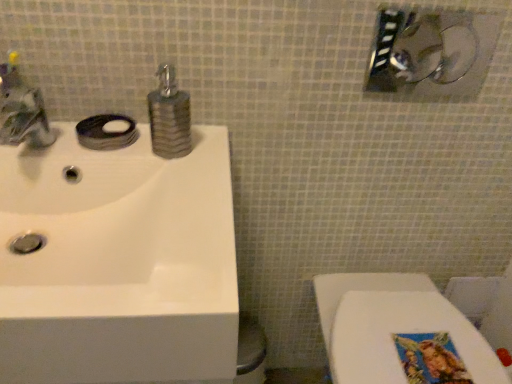
What do you see at coordinates (399, 332) in the screenshot?
I see `white glossy toilet at lower right` at bounding box center [399, 332].

The height and width of the screenshot is (384, 512). What do you see at coordinates (117, 126) in the screenshot? I see `matte silver soap at sink left` at bounding box center [117, 126].

The height and width of the screenshot is (384, 512). What do you see at coordinates (113, 248) in the screenshot?
I see `white glossy sink at upper left` at bounding box center [113, 248].

What is the approximate height of white glossy sink at upper left?

white glossy sink at upper left is 13.50 centimeters in height.

Image resolution: width=512 pixels, height=384 pixels. Identify the location of white glossy toilet at lower right. (399, 332).

From a real-world perspective, is white glossy sink at upper left under white glossy toilet at lower right?

Actually, white glossy sink at upper left is physically above white glossy toilet at lower right in the real world.

Is white glossy sink at upper left to the left of white glossy toilet at lower right from the viewer's perspective?

Yes.

The image size is (512, 384). What are the coordinates of `toilet below the white glossy sink at upper left (from the image's perspective)` in the screenshot? It's located at (399, 332).

Is white glossy sink at upper left thinner than white glossy toilet at lower right?

No, white glossy sink at upper left is not thinner than white glossy toilet at lower right.

From a real-world perspective, who is located lower, matte silver soap at sink left or brushed metal showerhead at upper right?

matte silver soap at sink left.

Does point (108, 129) appear closer or farther from the camera than point (468, 50)?

Clearly, point (108, 129) is closer to the camera than point (468, 50).

Between matte silver soap at sink left and brushed metal showerhead at upper right, which one has smaller size?

matte silver soap at sink left.

Based on the photo, is textured brown soap dispenser at center inside the boundaries of brushed metal faucet at upper left, or outside?

textured brown soap dispenser at center cannot be found inside brushed metal faucet at upper left.

Is textured brown soap dispenser at center next to brushed metal faucet at upper left and touching it?

No, textured brown soap dispenser at center is not beside brushed metal faucet at upper left.

Which object is thinner, textured brown soap dispenser at center or brushed metal faucet at upper left?

textured brown soap dispenser at center is thinner.

Which object is further away from the camera, textured brown soap dispenser at center or brushed metal faucet at upper left?

Positioned behind is textured brown soap dispenser at center.

In terms of height, does matte silver soap at sink left look taller or shorter compared to textured brown soap dispenser at center?

Clearly, matte silver soap at sink left is shorter compared to textured brown soap dispenser at center.

In the image, is matte silver soap at sink left positioned in front of or behind textured brown soap dispenser at center?

In the image, matte silver soap at sink left appears behind textured brown soap dispenser at center.

Could you tell me if matte silver soap at sink left is turned towards textured brown soap dispenser at center?

No, matte silver soap at sink left is not oriented towards textured brown soap dispenser at center.

Is there a large distance between matte silver soap at sink left and textured brown soap dispenser at center?

No, matte silver soap at sink left is in close proximity to textured brown soap dispenser at center.

Relative to brushed metal faucet at upper left, is brushed metal showerhead at upper right in front or behind?

Clearly, brushed metal showerhead at upper right is behind brushed metal faucet at upper left.

The height and width of the screenshot is (384, 512). I want to click on shower that is above the brushed metal faucet at upper left (from the image's perspective), so click(422, 50).

Are brushed metal showerhead at upper right and brushed metal faucet at upper left far apart?

No, brushed metal showerhead at upper right is not far away from brushed metal faucet at upper left.

Can you confirm if white glossy toilet at lower right is thinner than textured brown soap dispenser at center?

No, white glossy toilet at lower right is not thinner than textured brown soap dispenser at center.

Is white glossy toilet at lower right positioned with its back to textured brown soap dispenser at center?

No, textured brown soap dispenser at center is not at the back of white glossy toilet at lower right.

How many degrees apart are the facing directions of white glossy toilet at lower right and textured brown soap dispenser at center?

white glossy toilet at lower right and textured brown soap dispenser at center are facing 1.16 degrees away from each other.

Does white glossy toilet at lower right have a larger size compared to textured brown soap dispenser at center?

Yes, white glossy toilet at lower right is bigger than textured brown soap dispenser at center.

From the image's perspective, is textured brown soap dispenser at center beneath white glossy toilet at lower right?

No, from the image's perspective, textured brown soap dispenser at center is not below white glossy toilet at lower right.

Considering the positions of objects textured brown soap dispenser at center and white glossy toilet at lower right in the image provided, who is more to the left, textured brown soap dispenser at center or white glossy toilet at lower right?

textured brown soap dispenser at center.

Are textured brown soap dispenser at center and white glossy toilet at lower right far apart?

No.

Considering the relative sizes of textured brown soap dispenser at center and white glossy toilet at lower right in the image provided, is textured brown soap dispenser at center bigger than white glossy toilet at lower right?

No.

At what (x,y) coordinates should I click in order to perform the action: click on sink that appears in front of the white glossy toilet at lower right. Please return your answer as a coordinate pair (x, y). Looking at the image, I should click on (113, 248).

There is a matte silver soap at sink left. Where is `shower above it (from a real-world perspective)`? This screenshot has height=384, width=512. shower above it (from a real-world perspective) is located at coordinates (422, 50).

From the image, which object appears to be nearer to white glossy sink at upper left, brushed metal showerhead at upper right or matte silver soap at sink left?

matte silver soap at sink left.

When comparing their distances from brushed metal faucet at upper left, does matte silver soap at sink left or white glossy sink at upper left seem further?

white glossy sink at upper left.

Looking at the image, which one is located further to matte silver soap at sink left, white glossy toilet at lower right or textured brown soap dispenser at center?

Among the two, white glossy toilet at lower right is located further to matte silver soap at sink left.

Which object lies further to the anchor point brushed metal showerhead at upper right, white glossy sink at upper left or brushed metal faucet at upper left?

Based on the image, brushed metal faucet at upper left appears to be further to brushed metal showerhead at upper right.

From the image, which object appears to be nearer to brushed metal showerhead at upper right, brushed metal faucet at upper left or white glossy toilet at lower right?

white glossy toilet at lower right is positioned closer to the anchor brushed metal showerhead at upper right.

Estimate the real-world distances between objects in this image. Which object is closer to brushed metal faucet at upper left, white glossy sink at upper left or white glossy toilet at lower right?

The object closer to brushed metal faucet at upper left is white glossy sink at upper left.

Based on their spatial positions, is white glossy toilet at lower right or brushed metal faucet at upper left further from white glossy sink at upper left?

white glossy toilet at lower right lies further to white glossy sink at upper left than the other object.

Considering their positions, is white glossy sink at upper left positioned further to brushed metal showerhead at upper right than matte silver soap at sink left?

matte silver soap at sink left is positioned further to the anchor brushed metal showerhead at upper right.

You are a GUI agent. You are given a task and a screenshot of the screen. Output one action in this format:
    pyautogui.click(x=<x>, y=<y>)
    Task: Click on the soap dispenser located between brushed metal faucet at upper left and white glossy toilet at lower right in the left-right direction
    The width and height of the screenshot is (512, 384).
    Given the screenshot: What is the action you would take?
    pyautogui.click(x=169, y=116)

Find the location of `soap dispenser that lies between brushed metal showerhead at upper right and white glossy toilet at lower right from top to bottom`. soap dispenser that lies between brushed metal showerhead at upper right and white glossy toilet at lower right from top to bottom is located at coordinates (169, 116).

Locate an element on the screen. The image size is (512, 384). soap located between brushed metal faucet at upper left and brushed metal showerhead at upper right in the left-right direction is located at coordinates (117, 126).

Find the location of a particular element. soap between brushed metal faucet at upper left and textured brown soap dispenser at center in the horizontal direction is located at coordinates (117, 126).